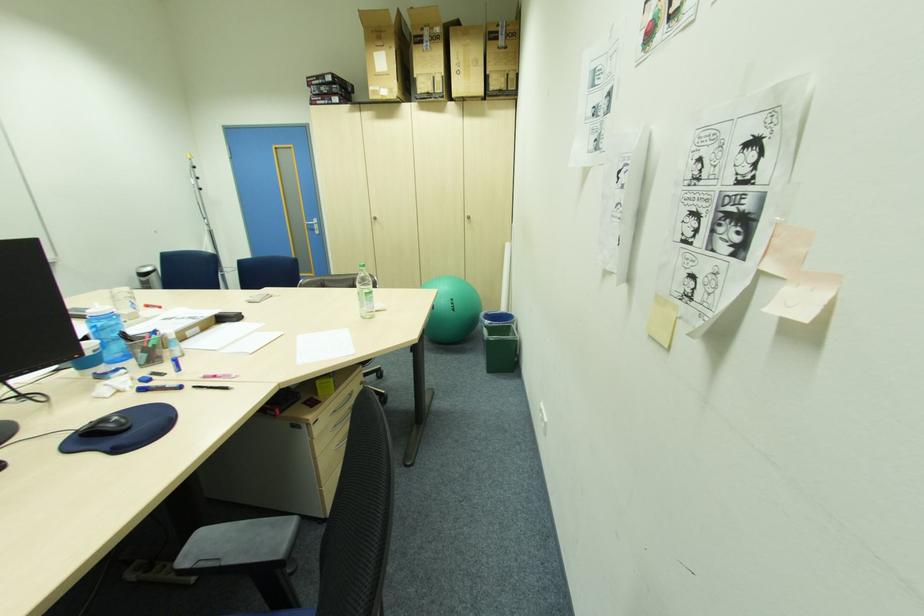
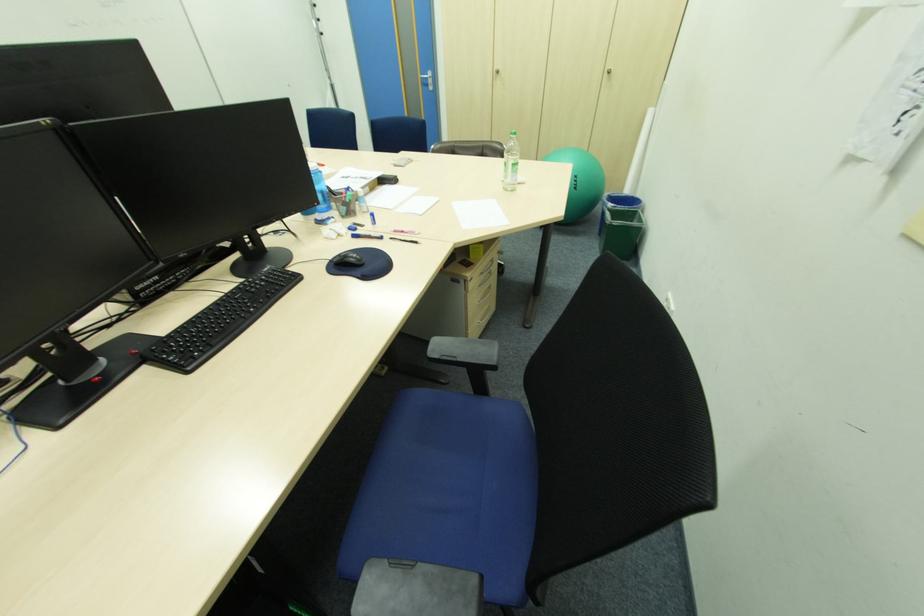
Locate, in the second image, the point that corresponds to (x=457, y=300) in the first image.

(581, 177)